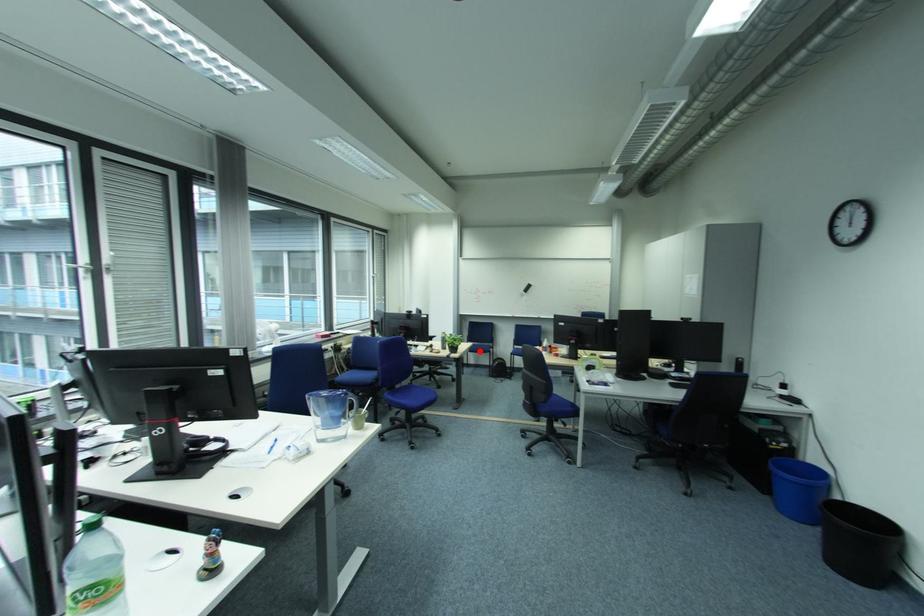
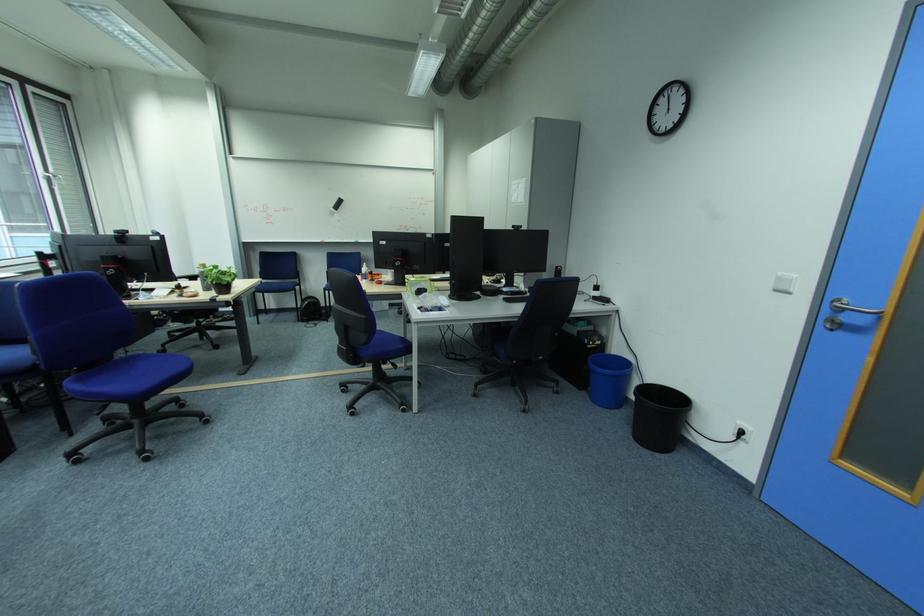
Locate, in the second image, the point that corresponds to the highlighted location in the first image.

(271, 291)